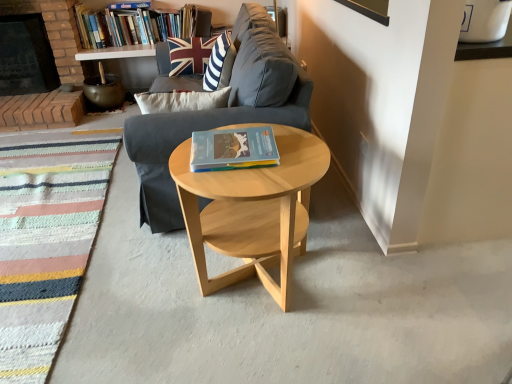
Question: Is striped fabric rug at lower left to the right of hardcover book at center, the 1th book from the bottom, from the viewer's perspective?

Choices:
 (A) no
 (B) yes

Answer: (A)

Question: Can you confirm if striped fabric rug at lower left is smaller than hardcover book at center, which is counted as the 2th book, starting from the back?

Choices:
 (A) yes
 (B) no

Answer: (B)

Question: Is striped fabric rug at lower left taller than hardcover book at center, the 1th book from the bottom?

Choices:
 (A) yes
 (B) no

Answer: (B)

Question: From a real-world perspective, is striped fabric rug at lower left located beneath hardcover book at center, which is counted as the 2th book, starting from the back?

Choices:
 (A) yes
 (B) no

Answer: (A)

Question: Is striped fabric rug at lower left facing away from hardcover book at center, the second book from the left?

Choices:
 (A) yes
 (B) no

Answer: (B)

Question: Is brick fireplace at left inside or outside of gray fabric couch at center?

Choices:
 (A) inside
 (B) outside

Answer: (B)

Question: Based on their sizes in the image, would you say brick fireplace at left is bigger or smaller than gray fabric couch at center?

Choices:
 (A) big
 (B) small

Answer: (B)

Question: Is brick fireplace at left in front of or behind gray fabric couch at center in the image?

Choices:
 (A) behind
 (B) front

Answer: (A)

Question: In terms of height, does brick fireplace at left look taller or shorter compared to gray fabric couch at center?

Choices:
 (A) tall
 (B) short

Answer: (B)

Question: In the image, is hardcover book at center, the second book from the left, on the left side or the right side of gray fabric couch at center?

Choices:
 (A) right
 (B) left

Answer: (A)

Question: Do you think hardcover book at center, which is counted as the second book, starting from the top, is within gray fabric couch at center, or outside of it?

Choices:
 (A) outside
 (B) inside

Answer: (A)

Question: Does point (251, 165) appear closer or farther from the camera than point (243, 13)?

Choices:
 (A) closer
 (B) farther

Answer: (A)

Question: In terms of size, does hardcover book at center, which is counted as the second book, starting from the top, appear bigger or smaller than gray fabric couch at center?

Choices:
 (A) big
 (B) small

Answer: (B)

Question: In terms of size, does union jack fabric pillow at upper center appear bigger or smaller than striped fabric rug at lower left?

Choices:
 (A) small
 (B) big

Answer: (A)

Question: Is union jack fabric pillow at upper center inside or outside of striped fabric rug at lower left?

Choices:
 (A) inside
 (B) outside

Answer: (B)